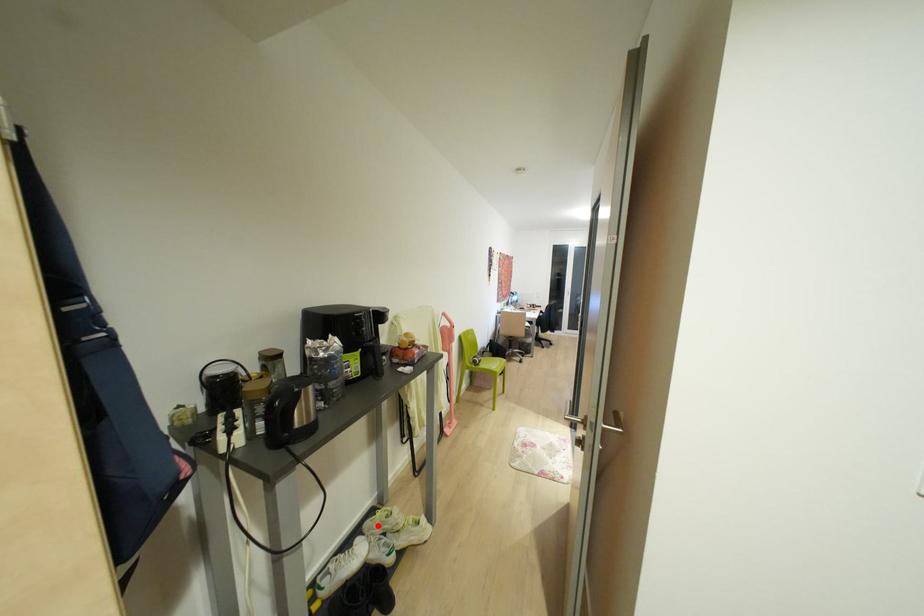
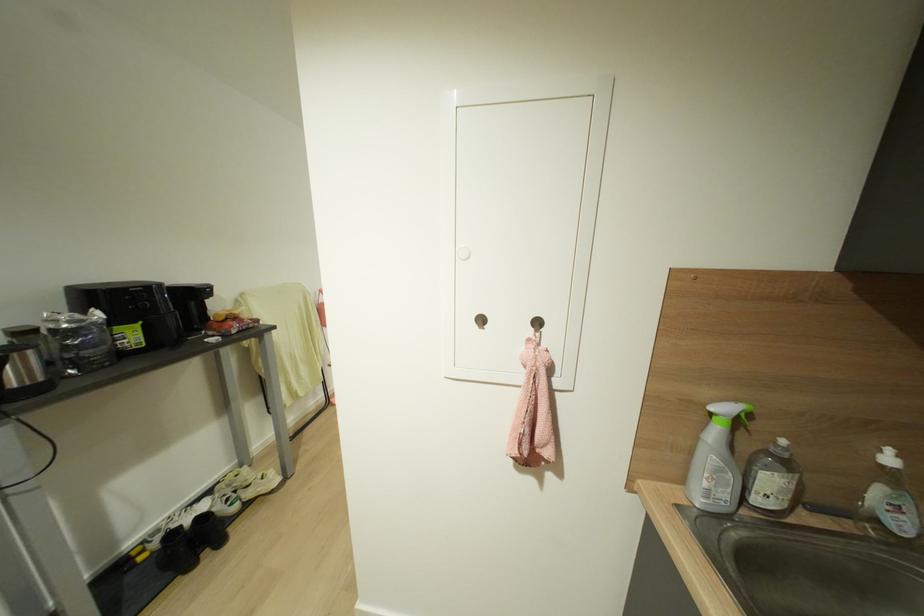
Question: I am providing you with two images of the same scene from different viewpoints. A red point is shown in image1. For the corresponding object point in image2, is it positioned nearer or farther from the camera?

Choices:
 (A) Nearer
 (B) Farther

Answer: (B)